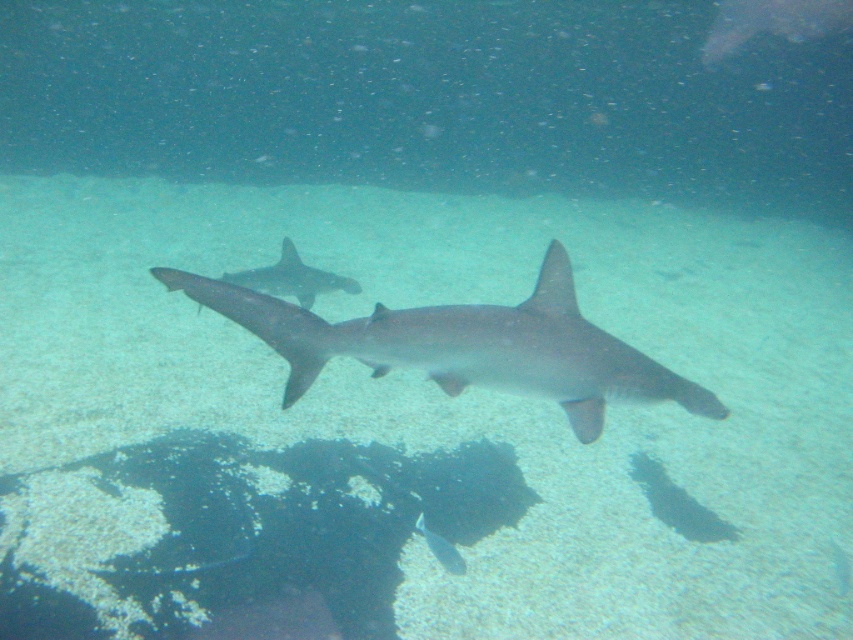
Does gray matte shark at center have a lesser width compared to shiny silver fish at center?

Incorrect, gray matte shark at center's width is not less than shiny silver fish at center's.

Does gray matte shark at center have a greater width compared to shiny silver fish at center?

Yes, gray matte shark at center is wider than shiny silver fish at center.

Is point (576, 346) positioned before point (444, 554)?

That is True.

Identify the location of gray matte shark at center. The height and width of the screenshot is (640, 853). (466, 346).